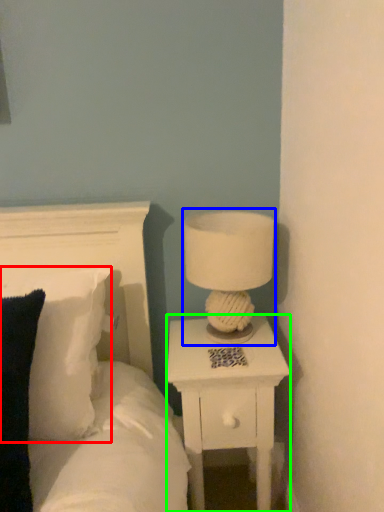
Question: Which object is positioned closest to pillow (highlighted by a red box)? Select from table lamp (highlighted by a blue box) and nightstand (highlighted by a green box).

Choices:
 (A) table lamp
 (B) nightstand

Answer: (B)